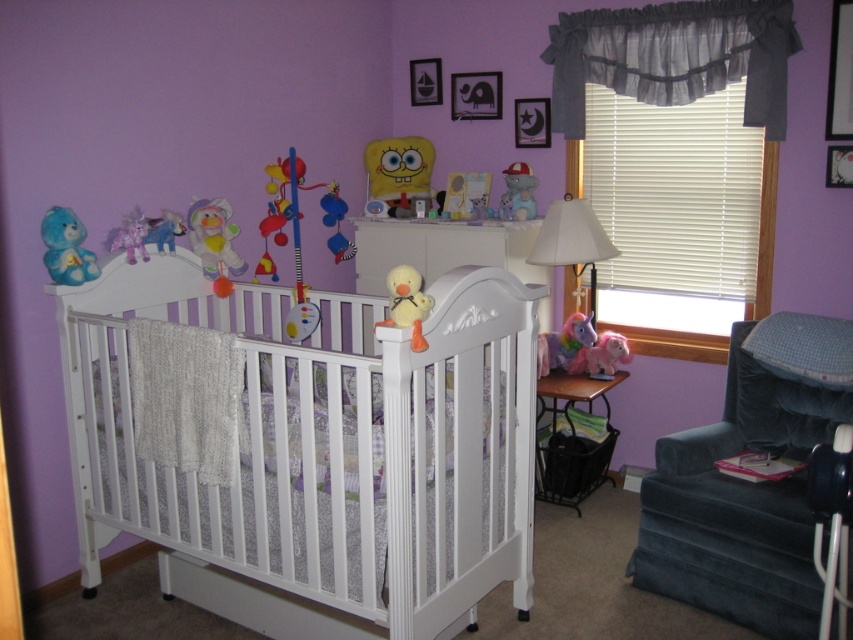
You are a parent trying to place the blue plush bear at left on top of the white wooden crib at center. Based on their sizes, will the bear fit comfortably without hanging off the edges?

The white wooden crib at center has a larger size compared to blue plush bear at left, so the bear will fit comfortably on top of the crib without hanging off the edges.

You are a parent trying to place a new mobile above the crib. The mobile needs to be centered exactly at the midpoint between the pink plush toy at center and the edge of the crib. Where should you place the mobile?

The mobile should be placed halfway between the pink plush toy at center and the edge of the crib. Since the pink plush toy at center is located at point (606,353), the midpoint would be calculated by averaging its coordinates with the edge of the crib. However, without specific coordinates for the crib edge, an exact placement cannot be determined. Please provide the coordinates of the crib edge for precise calculation.

In the nursery room, you see a pink plush toy at center and a wooden picture frame at upper center. Which object is positioned more to the right side of the room?

The pink plush toy at center is positioned more to the right side of the room compared to the wooden picture frame at upper center.